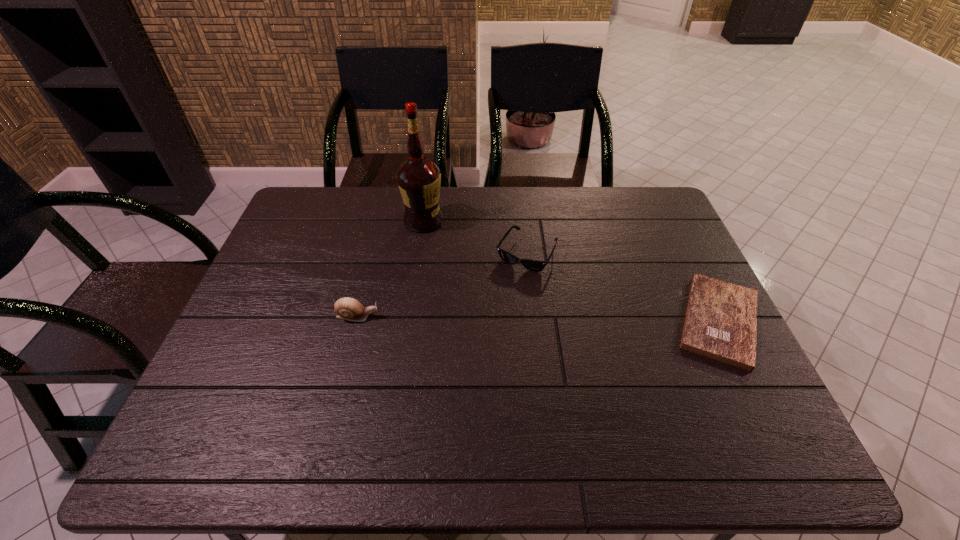
Where is `vacant space on the desktop that is between the second tallest object and the shortest object and is positioned on the front-facing side of the second object from right to left`? vacant space on the desktop that is between the second tallest object and the shortest object and is positioned on the front-facing side of the second object from right to left is located at coordinates (488, 318).

Identify the location of free spot on the desktop that is between the second tallest object and the Bible and is positioned on the label of the second object from left to right. (501, 318).